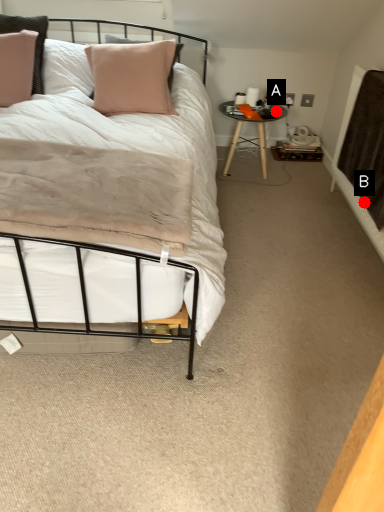
Question: Two points are circled on the image, labeled by A and B beside each circle. Among these points, which one is nearest to the camera?

Choices:
 (A) A is closer
 (B) B is closer

Answer: (B)